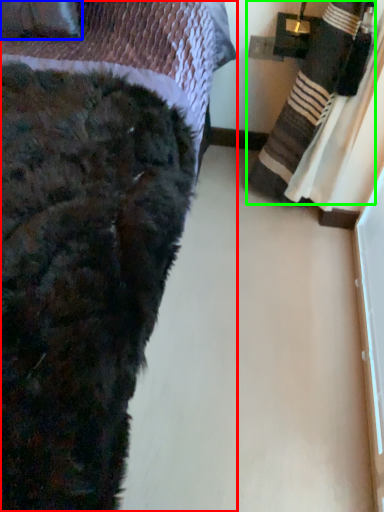
Question: Which is farther away from bed (highlighted by a red box)? throw pillow (highlighted by a blue box) or blanket (highlighted by a green box)?

Choices:
 (A) throw pillow
 (B) blanket

Answer: (B)